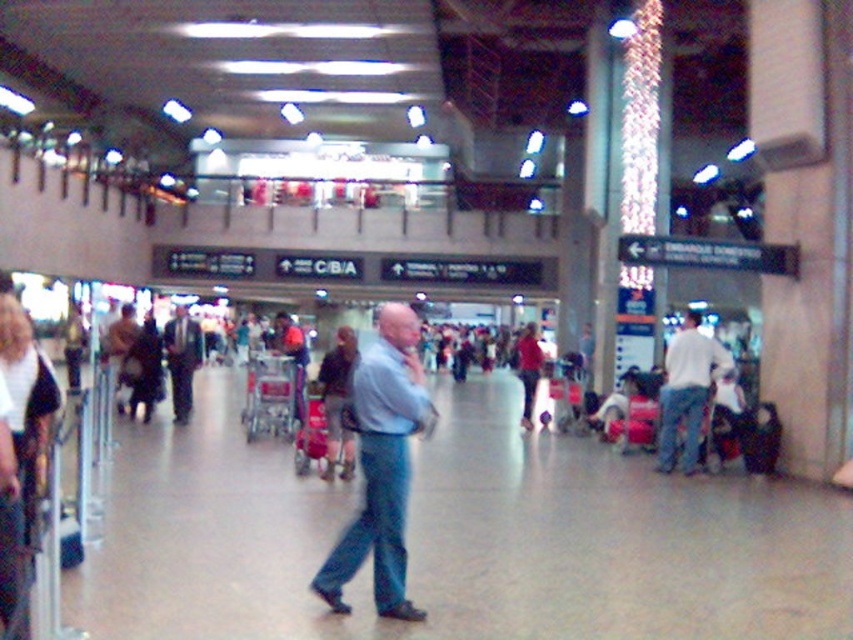
You are standing in the airport terminal and see the white cotton shirt at center and the matte black suitcase at lower right. Which object is closer to you?

The white cotton shirt at center is closer to you because it is further to the viewer than the matte black suitcase at lower right.

You are standing in the airport terminal and see a traveler wearing a white cotton shirt at center. If you want to locate them precisely, what are their coordinates?

The white cotton shirt at center is located at coordinates point (688,392).

You are a security guard in the airport terminal and need to determine if the blue denim jeans at center and dark gray sweater at center are positioned in a way that might block the emergency exit sign. Since the emergency exit sign is placed above the objects, which object could potentially obscure the view of the sign?

The dark gray sweater at center has a greater height than the blue denim jeans at center, so it could potentially obscure the view of the emergency exit sign placed above them.